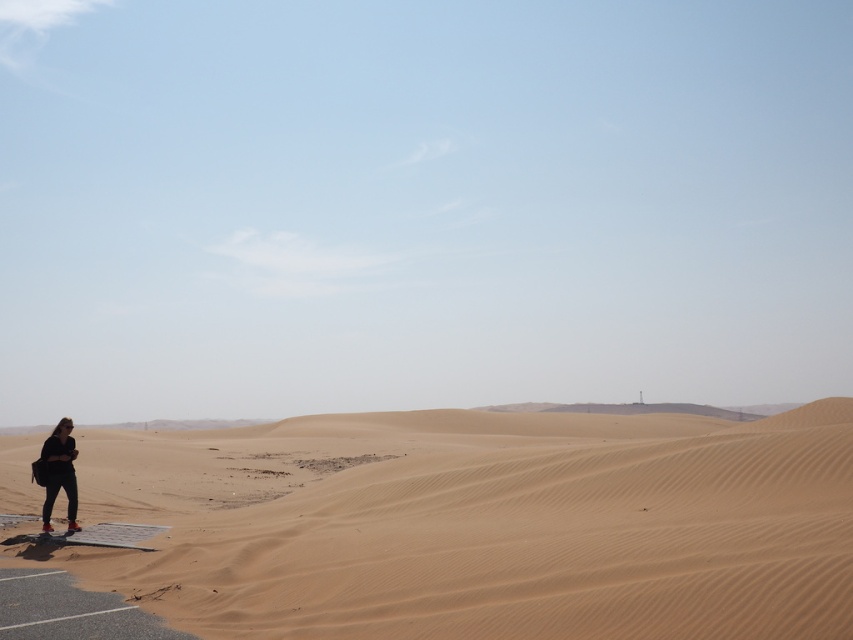
Is sandy beige dunes at lower left to the right of matte black jacket at lower left from the viewer's perspective?

Indeed, sandy beige dunes at lower left is positioned on the right side of matte black jacket at lower left.

Between point (796, 556) and point (62, 442), which one is positioned behind?

The point (62, 442) is behind.

Locate an element on the screen. The image size is (853, 640). sandy beige dunes at lower left is located at coordinates (477, 525).